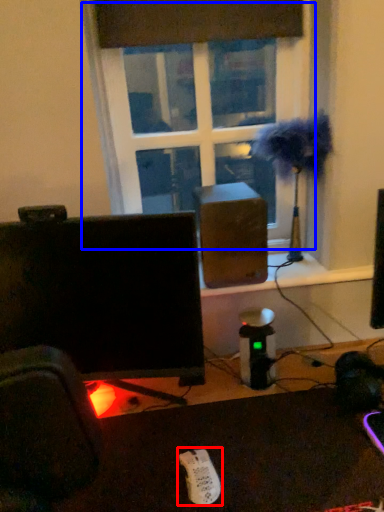
Question: Which object appears farthest to the camera in this image, Wii controller (highlighted by a red box) or window (highlighted by a blue box)?

Choices:
 (A) Wii controller
 (B) window

Answer: (B)